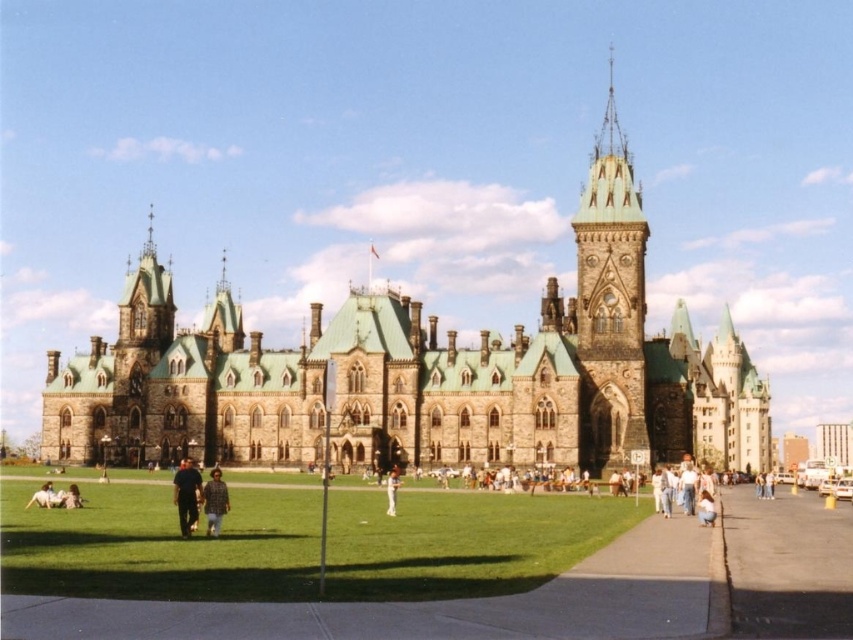
Question: Which is nearer to the light brown leather jacket at lower left?

Choices:
 (A) light brown leather jacket at lower right
 (B) asphalt at lower right

Answer: (A)

Question: Which of the following is the closest to the observer?

Choices:
 (A) (387, 497)
 (B) (815, 500)
 (C) (704, 492)
 (D) (102, 445)

Answer: (C)

Question: Is green grass at lower center further to camera compared to asphalt at lower right?

Choices:
 (A) no
 (B) yes

Answer: (B)

Question: Among these objects, which one is nearest to the camera?

Choices:
 (A) green grass at lower center
 (B) brown stone castle at center

Answer: (A)

Question: Does dark blue jeans at center have a smaller size compared to white cotton shirt at center?

Choices:
 (A) no
 (B) yes

Answer: (A)

Question: Does asphalt at lower right have a smaller size compared to light brown fabric pants at lower left?

Choices:
 (A) yes
 (B) no

Answer: (B)